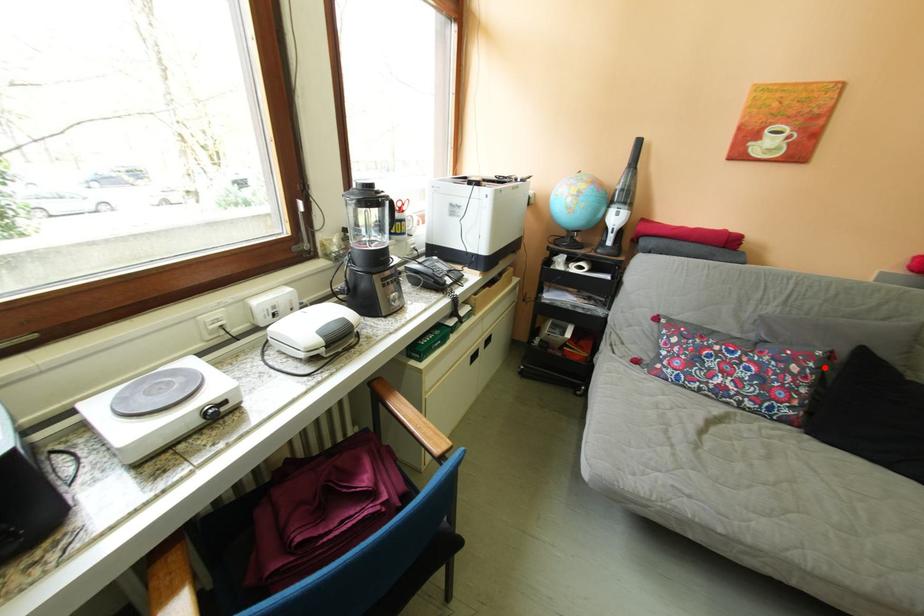
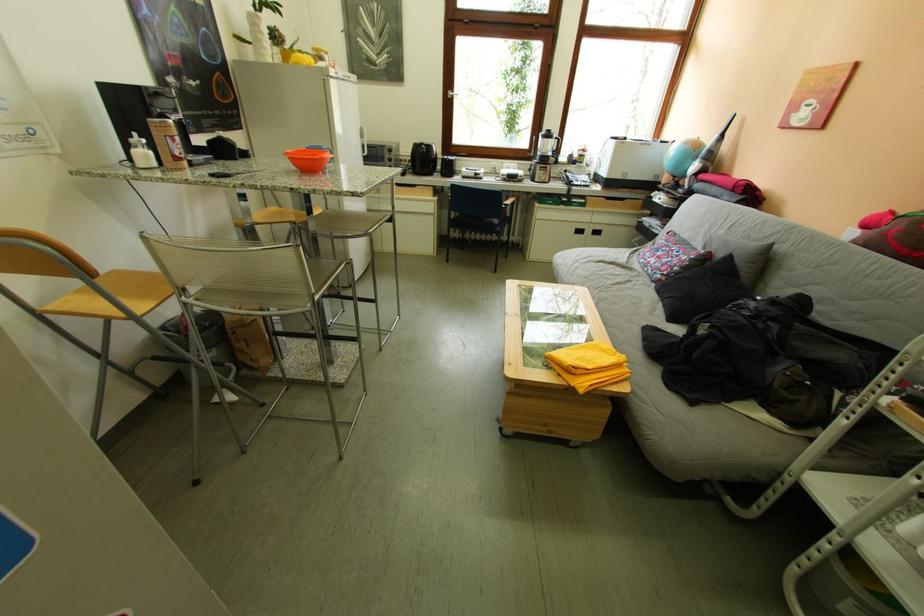
Where in the second image is the point corresponding to the highlighted location from the first image?

(706, 259)